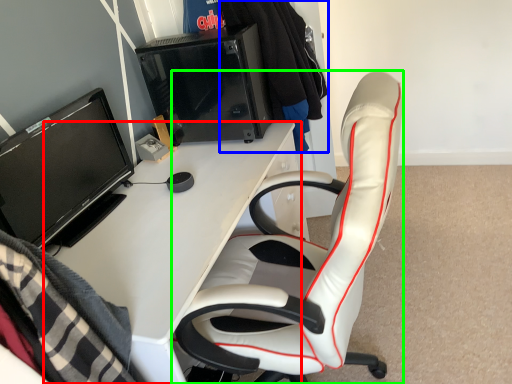
Question: Based on their relative distances, which object is nearer to desk (highlighted by a red box)? Choose from clothing (highlighted by a blue box) and chair (highlighted by a green box).

Choices:
 (A) clothing
 (B) chair

Answer: (B)